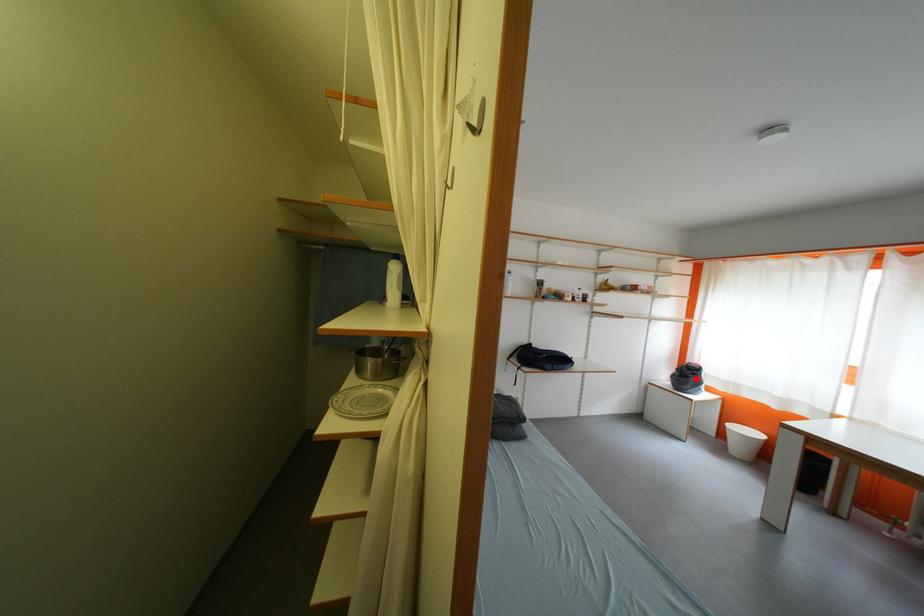
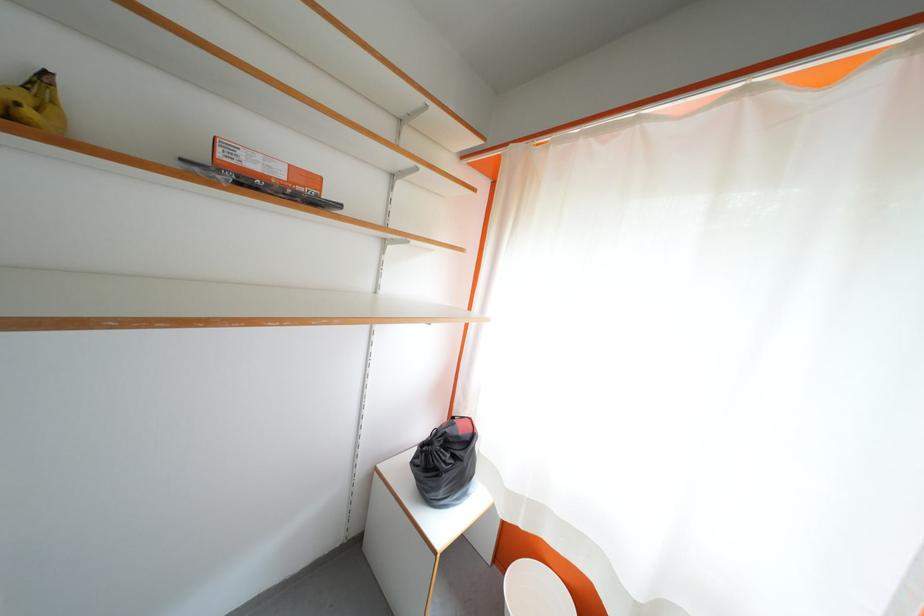
In the second image, find the point that corresponds to the highlighted location in the first image.

(455, 460)